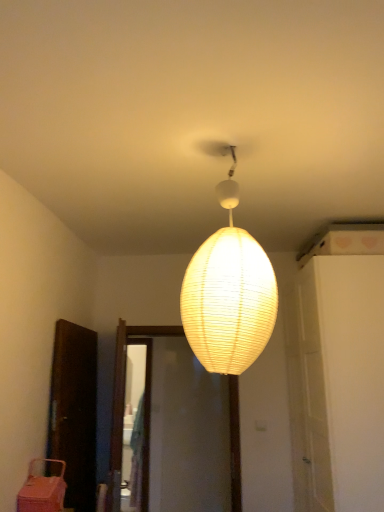
Question: Does white matte door at center right have a lesser width compared to ivory paper lampshade at center?

Choices:
 (A) yes
 (B) no

Answer: (B)

Question: Is white matte door at center right outside ivory paper lampshade at center?

Choices:
 (A) yes
 (B) no

Answer: (A)

Question: Does white matte door at center right have a greater width compared to ivory paper lampshade at center?

Choices:
 (A) yes
 (B) no

Answer: (A)

Question: Considering the relative positions of white matte door at center right and ivory paper lampshade at center in the image provided, is white matte door at center right in front of ivory paper lampshade at center?

Choices:
 (A) yes
 (B) no

Answer: (B)

Question: Would you say white matte door at center right contains ivory paper lampshade at center?

Choices:
 (A) no
 (B) yes

Answer: (A)

Question: From the image's perspective, is pink plastic basket at lower left positioned above or below white matte door at center right?

Choices:
 (A) below
 (B) above

Answer: (A)

Question: From their relative heights in the image, would you say pink plastic basket at lower left is taller or shorter than white matte door at center right?

Choices:
 (A) tall
 (B) short

Answer: (B)

Question: Looking at the image, does pink plastic basket at lower left seem bigger or smaller compared to white matte door at center right?

Choices:
 (A) small
 (B) big

Answer: (A)

Question: Considering the positions of point (34, 480) and point (354, 279), is point (34, 480) closer or farther from the camera than point (354, 279)?

Choices:
 (A) closer
 (B) farther

Answer: (A)

Question: In the image, is ivory paper lampshade at center positioned in front of or behind pink plastic basket at lower left?

Choices:
 (A) behind
 (B) front

Answer: (B)

Question: From their relative heights in the image, would you say ivory paper lampshade at center is taller or shorter than pink plastic basket at lower left?

Choices:
 (A) short
 (B) tall

Answer: (B)

Question: Does point (188, 313) appear closer or farther from the camera than point (23, 502)?

Choices:
 (A) farther
 (B) closer

Answer: (B)

Question: From a real-world perspective, is ivory paper lampshade at center physically located above or below pink plastic basket at lower left?

Choices:
 (A) below
 (B) above

Answer: (B)

Question: Do you think pink plastic basket at lower left is within ivory paper lampshade at center, or outside of it?

Choices:
 (A) outside
 (B) inside

Answer: (A)

Question: Based on their sizes in the image, would you say pink plastic basket at lower left is bigger or smaller than ivory paper lampshade at center?

Choices:
 (A) small
 (B) big

Answer: (A)